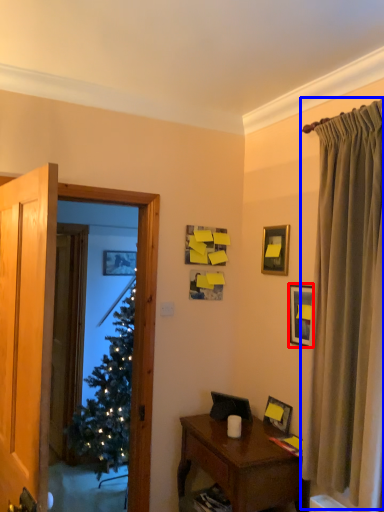
Question: Which point is closer to the camera, picture frame (highlighted by a red box) or curtain (highlighted by a blue box)?

Choices:
 (A) picture frame
 (B) curtain

Answer: (B)